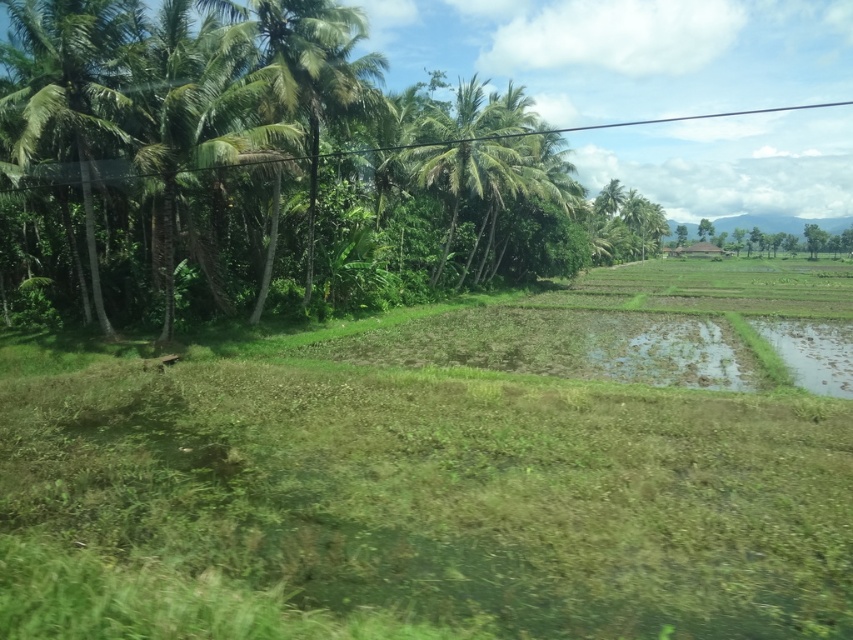
You are a hiker trying to navigate through the tropical landscape. You see the green leafy palm tree at left and the green leafy palm tree at center. Which palm tree is positioned lower in the image?

The green leafy palm tree at left is located below the green leafy palm tree at center, so it is positioned lower in the image.

You are a landscape architect planning to install a new pathway between the two green leafy palm trees. The pathway must be exactly 18 meters long. Based on the distance between the green leafy palm tree at left and the green leafy palm tree at center, will the pathway fit perfectly?

The distance between the green leafy palm tree at left and the green leafy palm tree at center is 17.66 meters, which is slightly shorter than the 18 meter pathway. Therefore, the pathway will not fit perfectly as it is 0.34 meters too long.